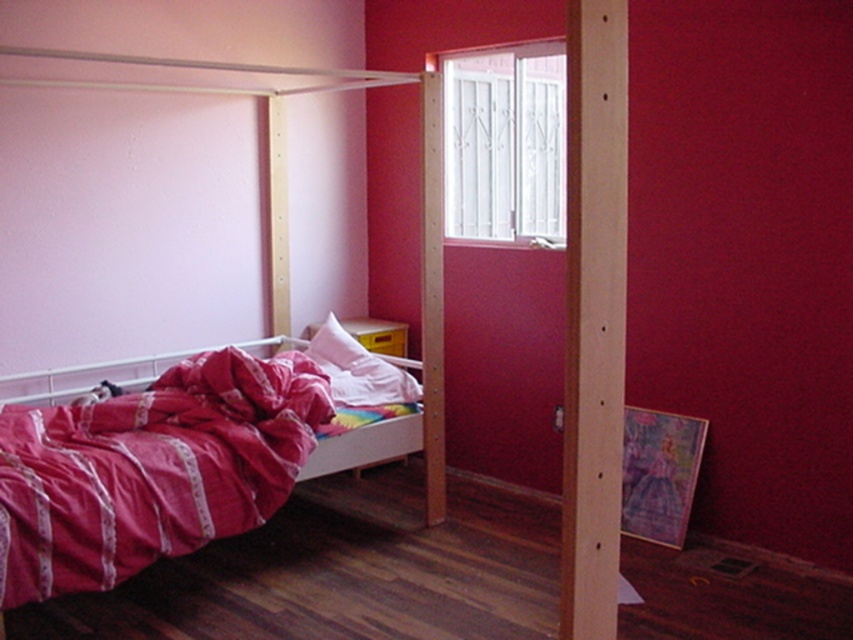
Question: Estimate the real-world distances between objects in this image. Which object is farther from the white metal window at upper center?

Choices:
 (A) wooden post at center
 (B) pink satin blanket at lower left
 (C) matte pink pillow at center

Answer: (A)

Question: Does white metal window at upper center appear over matte pink pillow at center?

Choices:
 (A) no
 (B) yes

Answer: (B)

Question: Which of the following is the farthest from the observer?

Choices:
 (A) pink satin blanket at lower left
 (B) matte pink pillow at center
 (C) pink fabric bed at left

Answer: (B)

Question: Which of the following is the farthest from the observer?

Choices:
 (A) (341, 68)
 (B) (531, 88)
 (C) (250, 497)

Answer: (B)

Question: Does pink satin blanket at lower left appear under matte pink pillow at center?

Choices:
 (A) yes
 (B) no

Answer: (A)

Question: Where is wooden post at center located in relation to matte pink pillow at center in the image?

Choices:
 (A) right
 (B) left

Answer: (A)